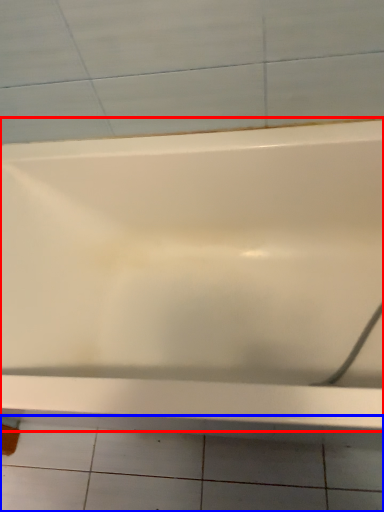
Question: Which of the following is the closest to the observer, bathtub (highlighted by a red box) or ceramic tile (highlighted by a blue box)?

Choices:
 (A) bathtub
 (B) ceramic tile

Answer: (A)